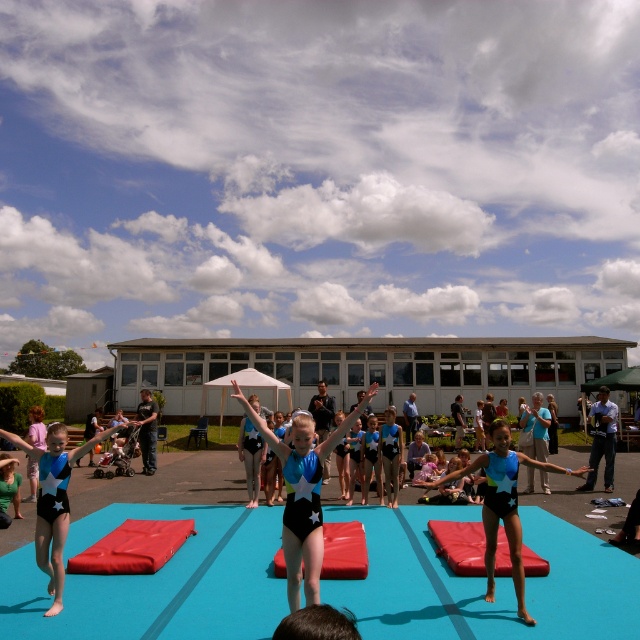
Who is positioned more to the right, blue spandex leotard at center or black leotard at left?

Positioned to the right is blue spandex leotard at center.

Is blue spandex leotard at center positioned before black leotard at left?

Yes, blue spandex leotard at center is closer to the viewer.

What do you see at coordinates (502, 504) in the screenshot?
I see `blue spandex leotard at center` at bounding box center [502, 504].

You are a GUI agent. You are given a task and a screenshot of the screen. Output one action in this format:
    pyautogui.click(x=<x>, y=<y>)
    Task: Click on the blue spandex leotard at center
    The image size is (640, 640).
    Given the screenshot: What is the action you would take?
    pyautogui.click(x=502, y=504)

Which is more to the left, shiny blue leotard at center or blue fabric jacket at lower right?

shiny blue leotard at center

Where is `shiny blue leotard at center`? The height and width of the screenshot is (640, 640). shiny blue leotard at center is located at coordinates (301, 493).

At what (x,y) coordinates should I click in order to perform the action: click on shiny blue leotard at center. Please return your answer as a coordinate pair (x, y). Looking at the image, I should click on (301, 493).